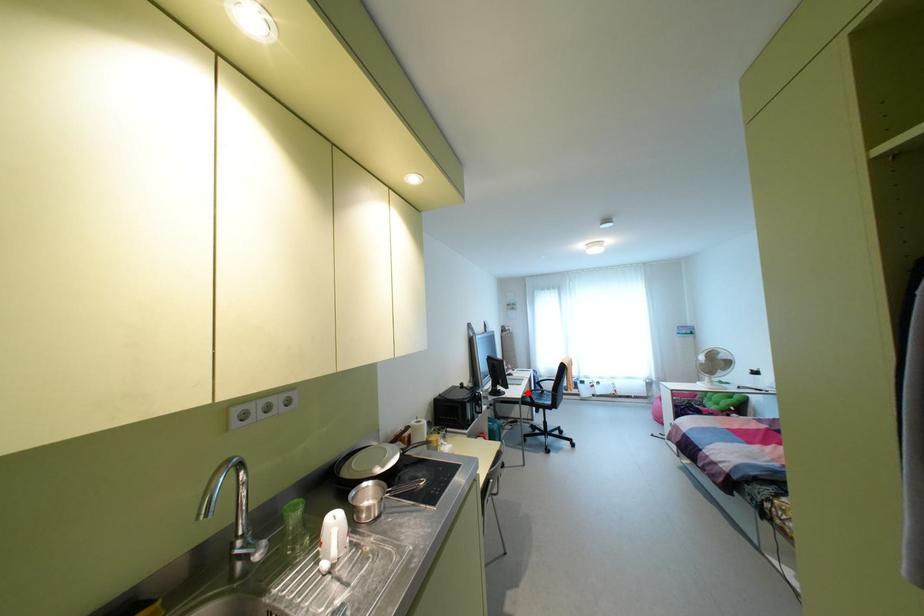
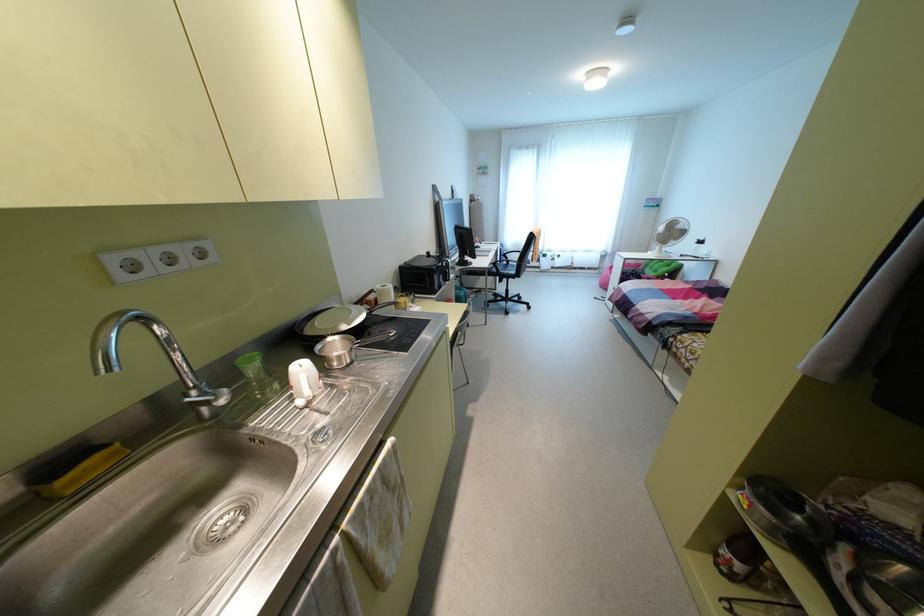
Question: I am providing you with two images of the same scene from different viewpoints. A red point is marked on the first image. Can you still see the location of the red point in image 2?

Choices:
 (A) Yes
 (B) No

Answer: (A)